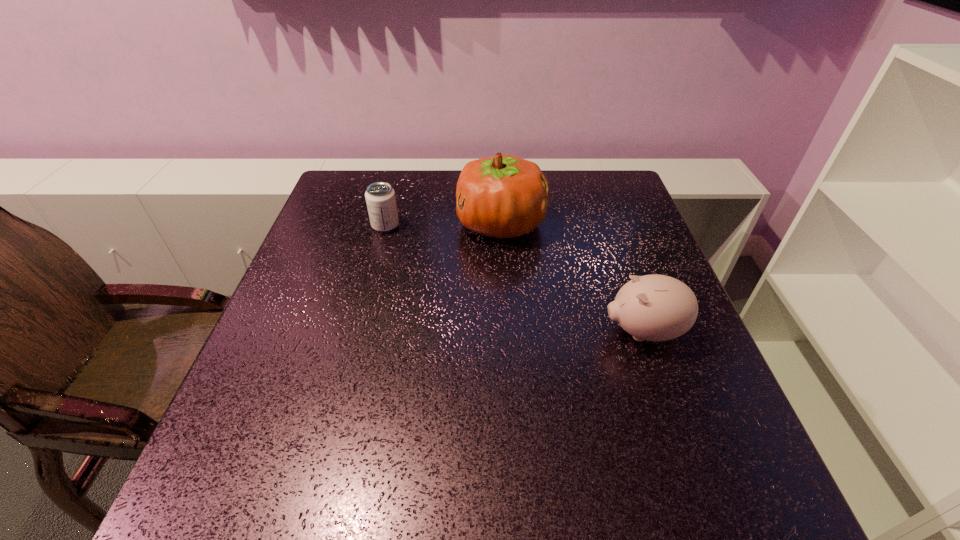
Find the location of a particular element. Image resolution: width=960 pixels, height=540 pixels. free space between the second object from left to right and the soda can is located at coordinates point(444,225).

Select which object appears as the second closest to the shortest object. Please provide its 2D coordinates. Your answer should be formatted as a tuple, i.e. [(x, y)], where the tuple contains the x and y coordinates of a point satisfying the conditions above.

[(654, 307)]

Where is `object that is the second nearest to the shortest object`? This screenshot has width=960, height=540. object that is the second nearest to the shortest object is located at coordinates (x=654, y=307).